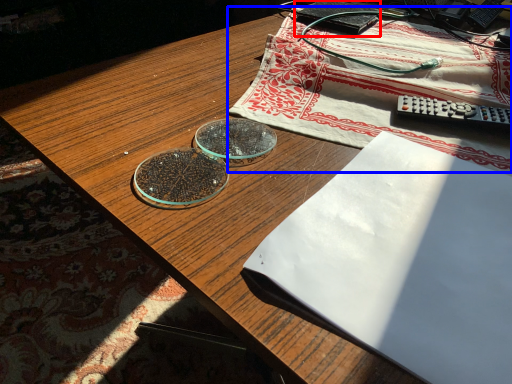
Question: Which point is closer to the camera, paperback book (highlighted by a red box) or tablecloth (highlighted by a blue box)?

Choices:
 (A) paperback book
 (B) tablecloth

Answer: (B)